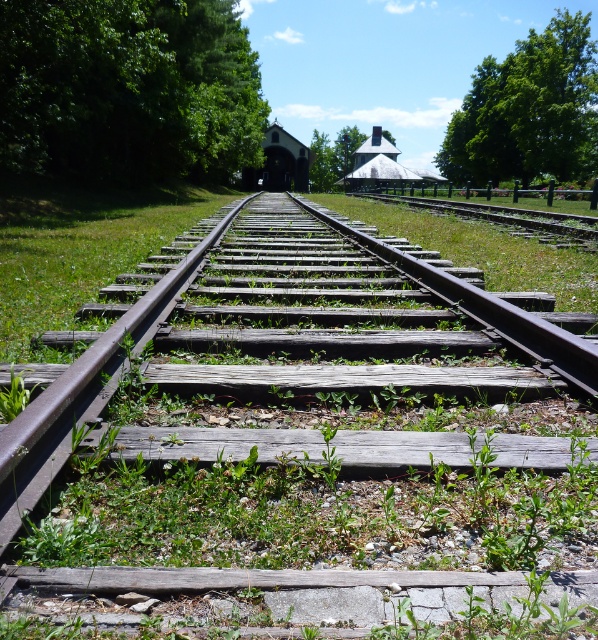
Is point (410, 429) more distant than point (178, 72)?

That is False.

Identify the location of weathered wood train track at center. The width and height of the screenshot is (598, 640). (315, 412).

Can you confirm if weathered wood train track at center is wider than green matte tree at upper center?

No.

Looking at this image, who is taller, weathered wood train track at center or green matte tree at upper center?

Standing taller between the two is green matte tree at upper center.

Is point (396, 456) closer to viewer compared to point (335, 164)?

Yes, it is in front of point (335, 164).

Where is `weathered wood train track at center`? The image size is (598, 640). weathered wood train track at center is located at coordinates (315, 412).

Looking at this image, can you confirm if weathered wood train track at center is wider than green leafy tree at upper right?

Incorrect, weathered wood train track at center's width does not surpass green leafy tree at upper right's.

The image size is (598, 640). I want to click on weathered wood train track at center, so pos(315,412).